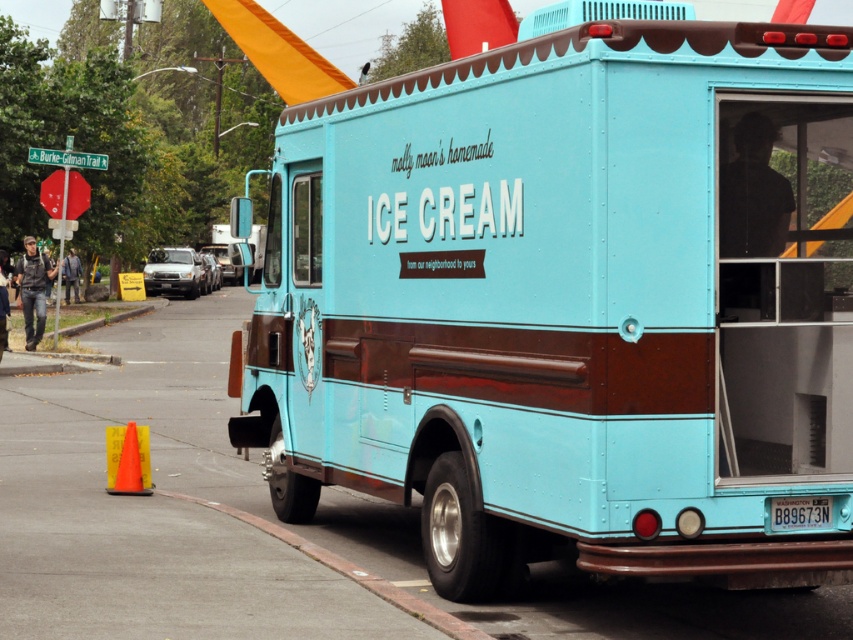
Which is in front, point (390, 288) or point (148, 488)?

Positioned in front is point (390, 288).

Who is positioned more to the right, matte blue ice cream truck at center or yellow plastic cone at lower left?

From the viewer's perspective, matte blue ice cream truck at center appears more on the right side.

This screenshot has height=640, width=853. What do you see at coordinates (572, 304) in the screenshot?
I see `matte blue ice cream truck at center` at bounding box center [572, 304].

I want to click on matte blue ice cream truck at center, so click(572, 304).

Can you confirm if matte blue ice cream truck at center is positioned below blue plastic license plate at rear?

Actually, matte blue ice cream truck at center is above blue plastic license plate at rear.

Identify the location of matte blue ice cream truck at center. The image size is (853, 640). (572, 304).

This screenshot has height=640, width=853. In order to click on matte blue ice cream truck at center in this screenshot , I will do `click(572, 304)`.

Does point (129, 484) come farther from viewer compared to point (822, 508)?

Yes, point (129, 484) is behind point (822, 508).

Does yellow plastic cone at lower left appear over blue plastic license plate at rear?

Incorrect, yellow plastic cone at lower left is not positioned above blue plastic license plate at rear.

In order to click on yellow plastic cone at lower left in this screenshot , I will do `click(126, 460)`.